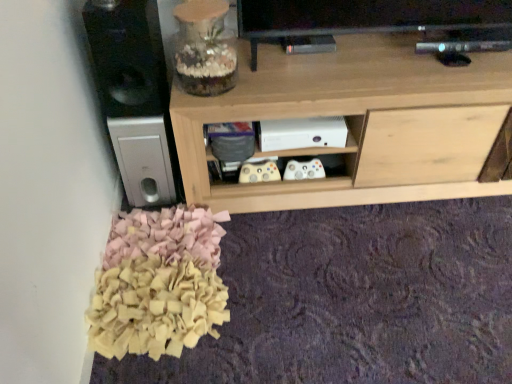
Question: Is black matte speaker at left positioned in front of light wood shelf at center?

Choices:
 (A) no
 (B) yes

Answer: (B)

Question: Does black matte speaker at left have a larger size compared to light wood shelf at center?

Choices:
 (A) no
 (B) yes

Answer: (A)

Question: From the image's perspective, does black matte speaker at left appear lower than light wood shelf at center?

Choices:
 (A) yes
 (B) no

Answer: (B)

Question: Is light wood shelf at center located within black matte speaker at left?

Choices:
 (A) yes
 (B) no

Answer: (B)

Question: Considering the relative sizes of black matte speaker at left and light wood shelf at center in the image provided, is black matte speaker at left wider than light wood shelf at center?

Choices:
 (A) no
 (B) yes

Answer: (A)

Question: Considering the relative sizes of black matte speaker at left and light wood shelf at center in the image provided, is black matte speaker at left thinner than light wood shelf at center?

Choices:
 (A) no
 (B) yes

Answer: (B)

Question: Is black matte speaker at left at the back of light wood shelf at center?

Choices:
 (A) no
 (B) yes

Answer: (A)

Question: Would you say light wood shelf at center is outside black matte speaker at left?

Choices:
 (A) yes
 (B) no

Answer: (A)

Question: Considering the relative sizes of light wood shelf at center and black matte speaker at left in the image provided, is light wood shelf at center thinner than black matte speaker at left?

Choices:
 (A) yes
 (B) no

Answer: (B)

Question: Could you tell me if light wood shelf at center is turned towards black matte speaker at left?

Choices:
 (A) no
 (B) yes

Answer: (A)

Question: From a real-world perspective, is light wood shelf at center beneath black matte speaker at left?

Choices:
 (A) yes
 (B) no

Answer: (A)

Question: From the image's perspective, is light wood shelf at center over black matte speaker at left?

Choices:
 (A) no
 (B) yes

Answer: (A)

Question: Does point (264, 109) appear closer or farther from the camera than point (98, 82)?

Choices:
 (A) farther
 (B) closer

Answer: (B)